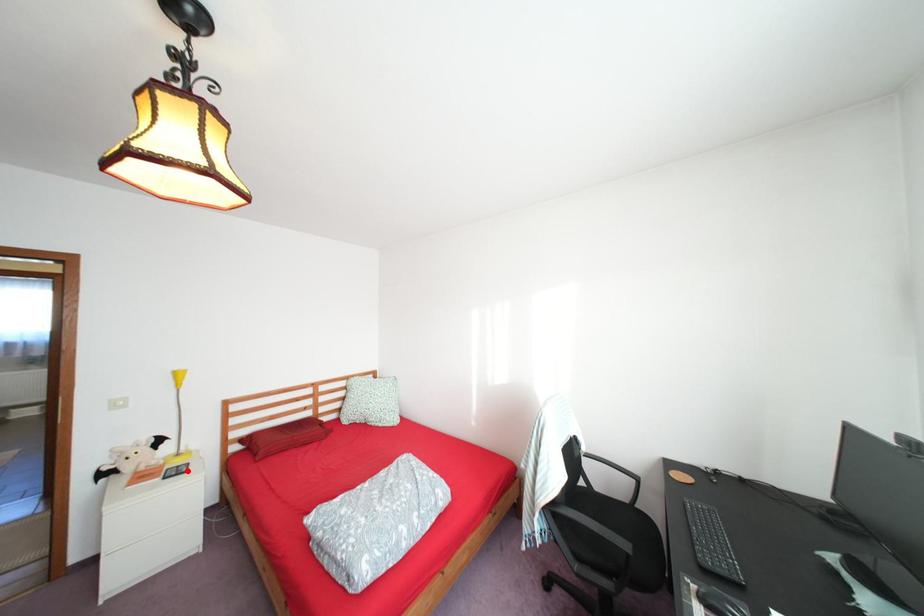
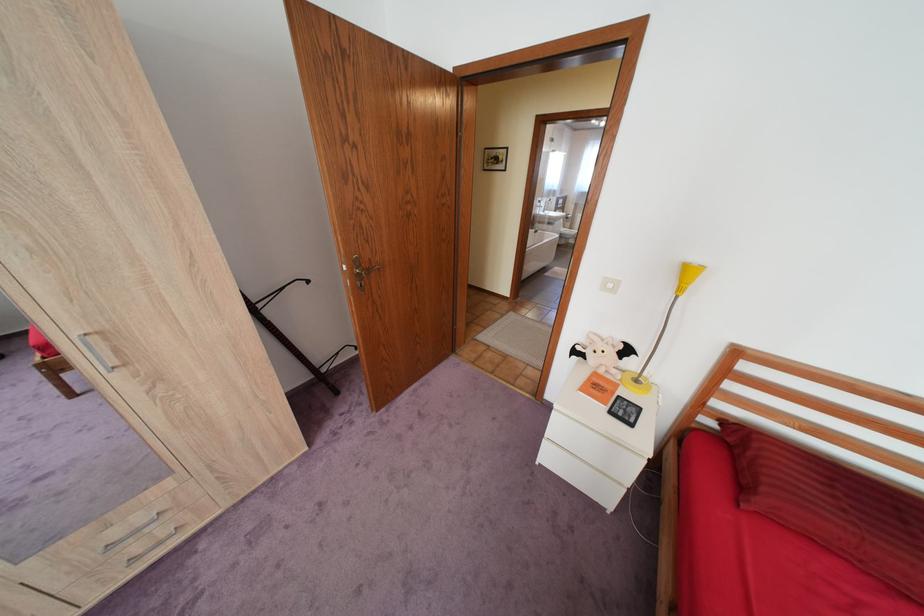
Where in the second image is the point corresponding to the highlighted location from the first image?

(636, 411)